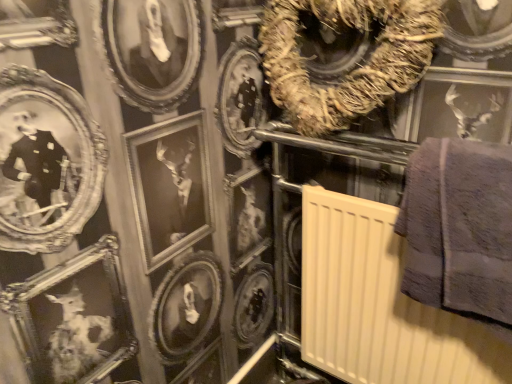
Question: Visually, is beige plastic radiator at center-right positioned to the left or to the right of gray fluffy towel at right?

Choices:
 (A) right
 (B) left

Answer: (B)

Question: Considering the positions of point (472, 355) and point (471, 231), is point (472, 355) closer or farther from the camera than point (471, 231)?

Choices:
 (A) farther
 (B) closer

Answer: (A)

Question: Based on their relative distances, which object is nearer to the brown textured wreath at upper center?

Choices:
 (A) beige plastic radiator at center-right
 (B) gray fluffy towel at right

Answer: (B)

Question: Which object is positioned farthest from the brown textured wreath at upper center?

Choices:
 (A) beige plastic radiator at center-right
 (B) gray fluffy towel at right

Answer: (A)